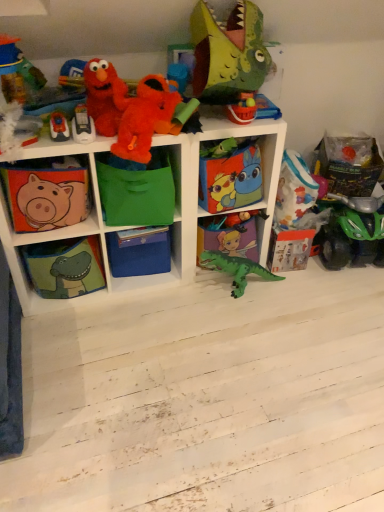
At what (x,y) coordinates should I click in order to perform the action: click on vacant space to the right of green plastic dinosaur at center, placed as the seventh toy when sorted from top to bottom. Please return your answer as a coordinate pair (x, y). Looking at the image, I should click on (292, 295).